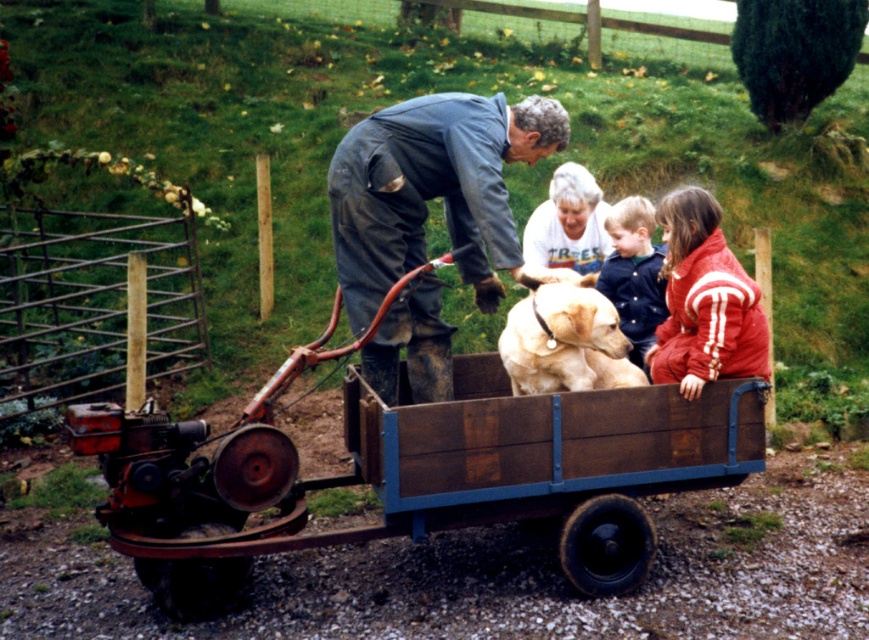
Question: Is dark blue coveralls at center to the left of blue denim jacket at center from the viewer's perspective?

Choices:
 (A) no
 (B) yes

Answer: (B)

Question: Which point is farther from the camera taking this photo?

Choices:
 (A) (622, 253)
 (B) (463, 157)

Answer: (A)

Question: Which object is farther from the camera taking this photo?

Choices:
 (A) rusty wood wagon at center
 (B) dark blue coveralls at center
 (C) red fleece jacket at right

Answer: (B)

Question: Estimate the real-world distances between objects in this image. Which object is closer to the golden fur dog at center?

Choices:
 (A) rusty wood wagon at center
 (B) red fleece jacket at right

Answer: (B)

Question: Is rusty wood wagon at center positioned before dark blue coveralls at center?

Choices:
 (A) no
 (B) yes

Answer: (B)

Question: Considering the relative positions of rusty wood wagon at center and red fleece jacket at right in the image provided, where is rusty wood wagon at center located with respect to red fleece jacket at right?

Choices:
 (A) above
 (B) below

Answer: (B)